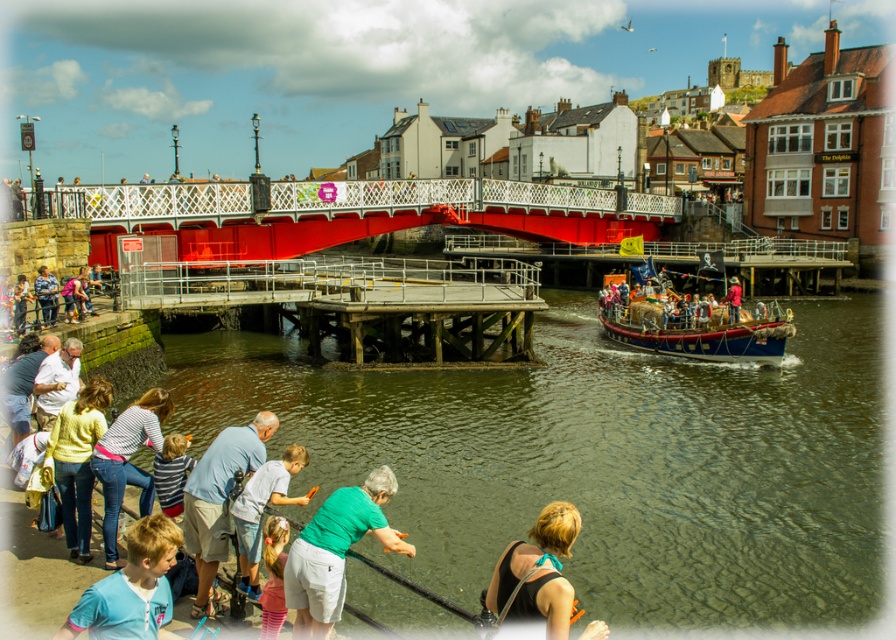
Question: Which is nearer to the jeans at lower left?

Choices:
 (A) denim jacket at lower left
 (B) metallic red bridge at center
 (C) striped fabric shirt at lower left
 (D) pink fabric at lower center

Answer: (C)

Question: Does matte gray clothing at lower left come in front of striped fabric shirt at lower left?

Choices:
 (A) yes
 (B) no

Answer: (B)

Question: In this image, where is metallic red bridge at center located relative to blue t-shirt at lower left?

Choices:
 (A) above
 (B) below

Answer: (A)

Question: Is metallic red bridge at center behind green fabric shirt at lower center?

Choices:
 (A) no
 (B) yes

Answer: (B)

Question: Which of the following is the closest to the observer?

Choices:
 (A) wooden polished boat at right
 (B) matte gray clothing at lower left
 (C) pink fabric at lower center
 (D) greenish-brown water at lower center

Answer: (C)

Question: Which point is closer to the camera?

Choices:
 (A) green fabric shirt at lower center
 (B) black fabric bag at lower center

Answer: (B)